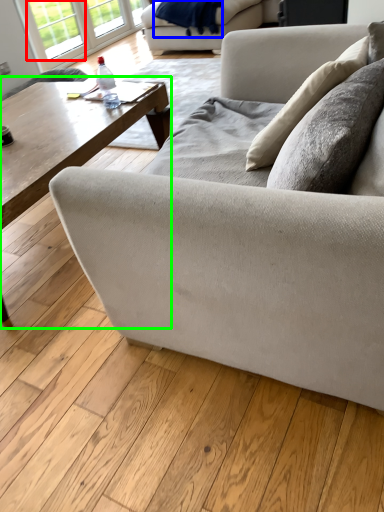
Question: Based on their relative distances, which object is nearer to window (highlighted by a red box)? Choose from blanket (highlighted by a blue box) and coffee table (highlighted by a green box).

Choices:
 (A) blanket
 (B) coffee table

Answer: (A)